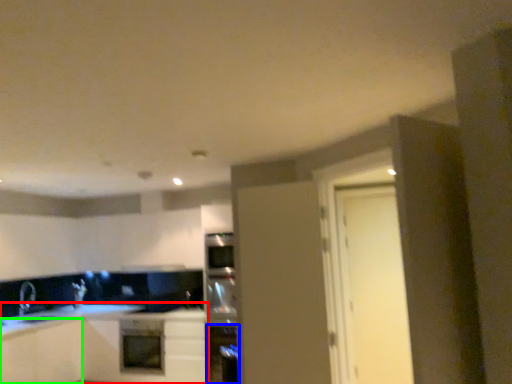
Question: Based on their relative distances, which object is nearer to cabinetry (highlighted by a red box)? Choose from appliance (highlighted by a blue box) and cabinetry (highlighted by a green box).

Choices:
 (A) appliance
 (B) cabinetry

Answer: (B)